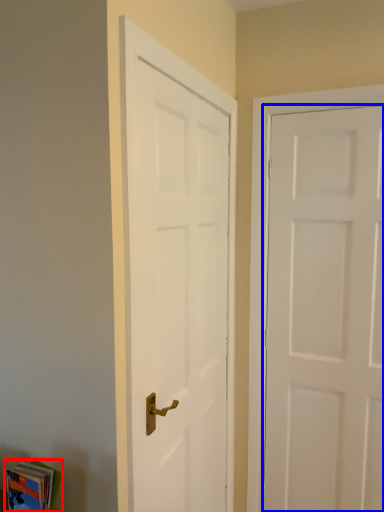
Question: Which point is closer to the camera, book (highlighted by a red box) or door (highlighted by a blue box)?

Choices:
 (A) book
 (B) door

Answer: (A)